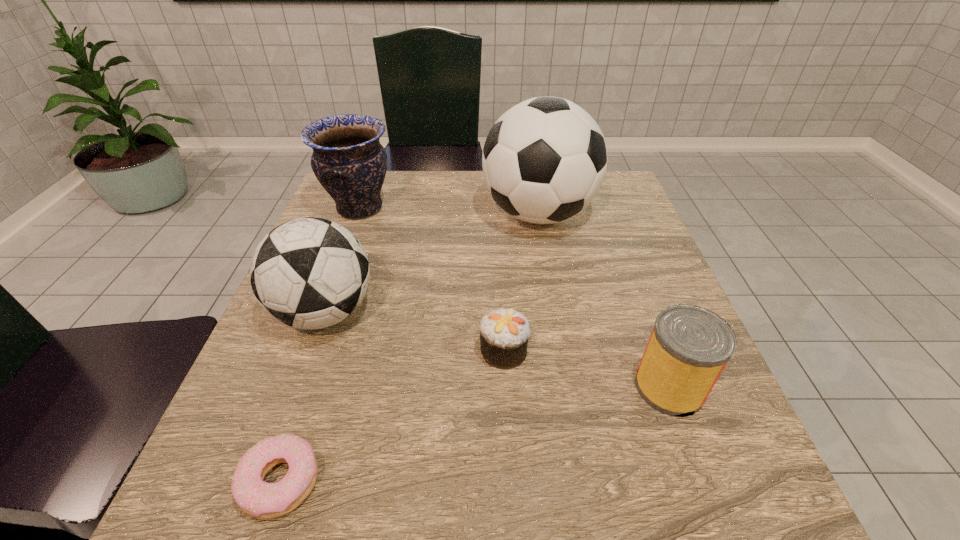
Locate an element on the screen. This screenshot has height=540, width=960. vacant space situated 0.190m on the front handle of the pottery is located at coordinates (468, 208).

You are a GUI agent. You are given a task and a screenshot of the screen. Output one action in this format:
    pyautogui.click(x=<x>, y=<y>)
    Task: Click on the free space located 0.160m on the surface of the shorter soccer ball where the brand logo is visible
    
    Given the screenshot: What is the action you would take?
    pyautogui.click(x=457, y=312)

Find the location of a particular element. The image size is (960, 540). free space located 0.140m on the back of the can is located at coordinates (638, 304).

Where is `vacant space located on the front of the cupcake`? Image resolution: width=960 pixels, height=540 pixels. vacant space located on the front of the cupcake is located at coordinates (506, 401).

Locate an element on the screen. This screenshot has width=960, height=540. vacant space located on the right of the shortest object is located at coordinates (600, 481).

This screenshot has height=540, width=960. I want to click on soccer ball located in the far edge section of the desktop, so click(x=544, y=160).

I want to click on pottery at the far edge, so click(x=348, y=160).

Image resolution: width=960 pixels, height=540 pixels. I want to click on object that is at the near edge, so click(x=257, y=498).

The height and width of the screenshot is (540, 960). I want to click on pottery positioned at the left edge, so click(348, 160).

The height and width of the screenshot is (540, 960). I want to click on soccer ball that is at the left edge, so click(x=310, y=273).